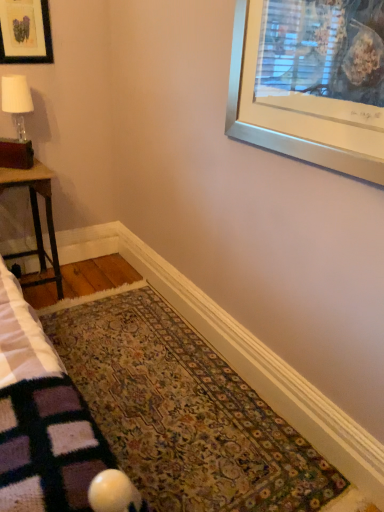
Question: From a real-world perspective, does matte glass lamp at left stand above floral carpet at center?

Choices:
 (A) no
 (B) yes

Answer: (B)

Question: From a real-world perspective, is matte glass lamp at left under floral carpet at center?

Choices:
 (A) no
 (B) yes

Answer: (A)

Question: Is matte glass lamp at left taller than floral carpet at center?

Choices:
 (A) no
 (B) yes

Answer: (B)

Question: Is matte glass lamp at left further to the viewer compared to floral carpet at center?

Choices:
 (A) no
 (B) yes

Answer: (B)

Question: Is matte glass lamp at left shorter than floral carpet at center?

Choices:
 (A) yes
 (B) no

Answer: (B)

Question: Is matte glass lamp at left to the left of floral carpet at center from the viewer's perspective?

Choices:
 (A) yes
 (B) no

Answer: (A)

Question: Is floral carpet at center oriented towards matte black picture frame at upper left?

Choices:
 (A) yes
 (B) no

Answer: (B)

Question: Is floral carpet at center positioned far away from matte black picture frame at upper left?

Choices:
 (A) no
 (B) yes

Answer: (B)

Question: Does floral carpet at center have a lesser width compared to matte black picture frame at upper left?

Choices:
 (A) yes
 (B) no

Answer: (B)

Question: Is floral carpet at center in contact with matte black picture frame at upper left?

Choices:
 (A) yes
 (B) no

Answer: (B)

Question: Is floral carpet at center located outside matte black picture frame at upper left?

Choices:
 (A) no
 (B) yes

Answer: (B)

Question: Considering the relative positions of floral carpet at center and matte black picture frame at upper left in the image provided, is floral carpet at center to the right of matte black picture frame at upper left from the viewer's perspective?

Choices:
 (A) yes
 (B) no

Answer: (A)

Question: From the image's perspective, is matte glass lamp at left on wooden table at left?

Choices:
 (A) no
 (B) yes

Answer: (B)